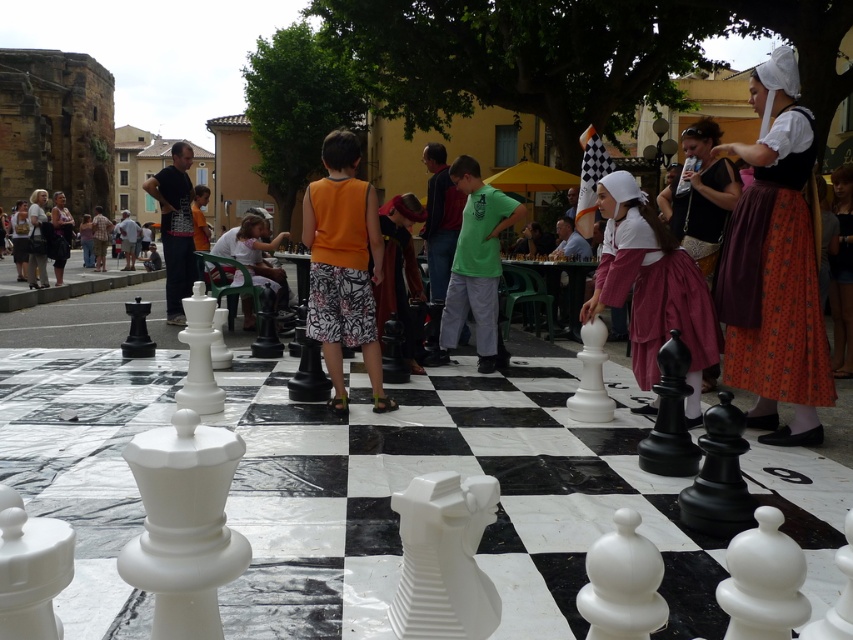
Can you confirm if orange printed skirt at center is positioned to the right of orange fabric shorts at center?

Indeed, orange printed skirt at center is positioned on the right side of orange fabric shorts at center.

Does orange printed skirt at center have a lesser height compared to orange fabric shorts at center?

In fact, orange printed skirt at center may be taller than orange fabric shorts at center.

Where is `orange printed skirt at center`? orange printed skirt at center is located at coordinates (775, 266).

Does point (732, 246) lie in front of point (480, 298)?

Yes, it is.

Is orange printed skirt at center in front of green matte shirt at center?

Yes.

The height and width of the screenshot is (640, 853). Find the location of `orange printed skirt at center`. orange printed skirt at center is located at coordinates (775, 266).

I want to click on orange printed skirt at center, so click(775, 266).

Is orange fabric shorts at center smaller than matte white shirt at left?

Correct, orange fabric shorts at center occupies less space than matte white shirt at left.

Consider the image. Which of these two, orange fabric shorts at center or matte white shirt at left, stands taller?

matte white shirt at left is taller.

The height and width of the screenshot is (640, 853). Describe the element at coordinates (343, 266) in the screenshot. I see `orange fabric shorts at center` at that location.

Identify the location of orange fabric shorts at center. This screenshot has height=640, width=853. (343, 266).